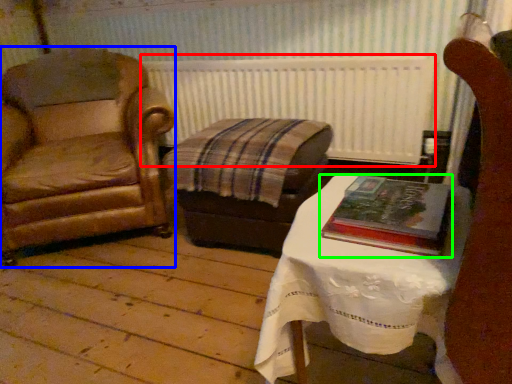
Question: Considering the real-world distances, which object is closest to radiator (highlighted by a red box)? chair (highlighted by a blue box) or book (highlighted by a green box).

Choices:
 (A) chair
 (B) book

Answer: (A)